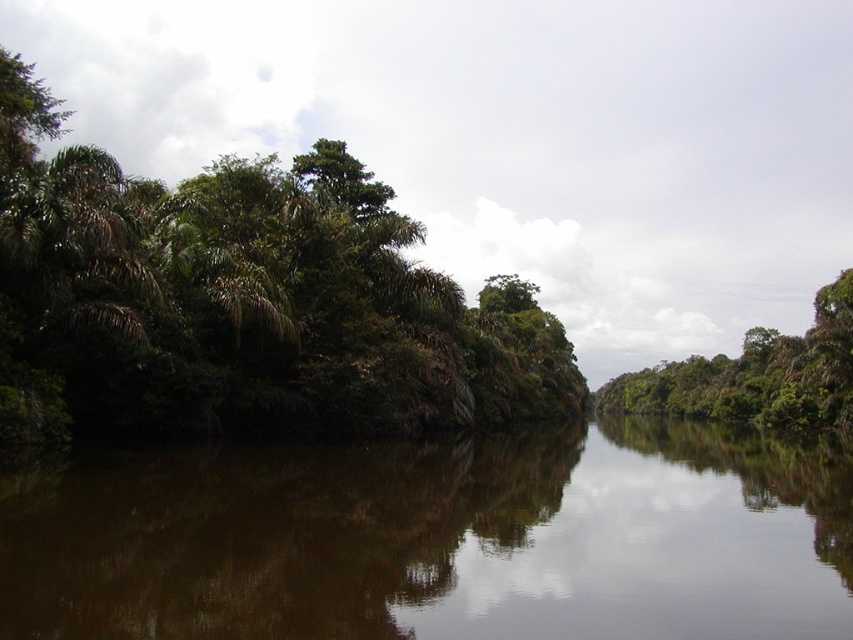
Question: Can you confirm if green leafy trees at left is wider than green leafy tree at center?

Choices:
 (A) no
 (B) yes

Answer: (B)

Question: Considering the real-world distances, which object is closest to the green leafy tree at center?

Choices:
 (A) brown reflective water at center
 (B) green leafy trees at left

Answer: (B)

Question: Which of the following is the closest to the observer?

Choices:
 (A) (339, 602)
 (B) (833, 285)

Answer: (A)

Question: Which of the following is the farthest from the observer?

Choices:
 (A) brown reflective water at center
 (B) green leafy trees at left
 (C) green leafy tree at center

Answer: (C)

Question: Does brown reflective water at center appear on the left side of green leafy trees at left?

Choices:
 (A) yes
 (B) no

Answer: (B)

Question: Does green leafy trees at left come in front of green leafy tree at center?

Choices:
 (A) yes
 (B) no

Answer: (A)